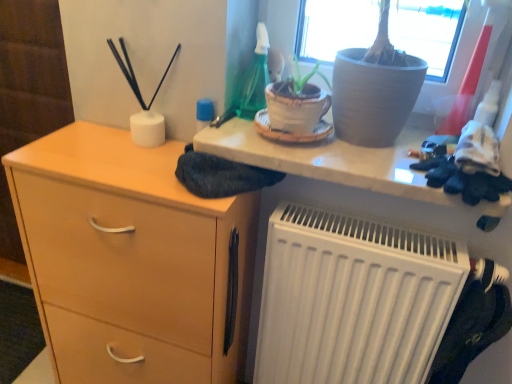
Question: In terms of height, does matte gray pot at upper center look taller or shorter compared to white matte radiator at lower right?

Choices:
 (A) short
 (B) tall

Answer: (A)

Question: In the image, is matte gray pot at upper center on the left side or the right side of white matte radiator at lower right?

Choices:
 (A) right
 (B) left

Answer: (B)

Question: Which object is positioned farthest from the light wood/finish chest of drawers at left?

Choices:
 (A) white matte radiator at lower right
 (B) matte gray pot at upper center

Answer: (B)

Question: Which of these objects is positioned farthest from the matte gray pot at upper center?

Choices:
 (A) white matte radiator at lower right
 (B) light wood/finish chest of drawers at left

Answer: (B)